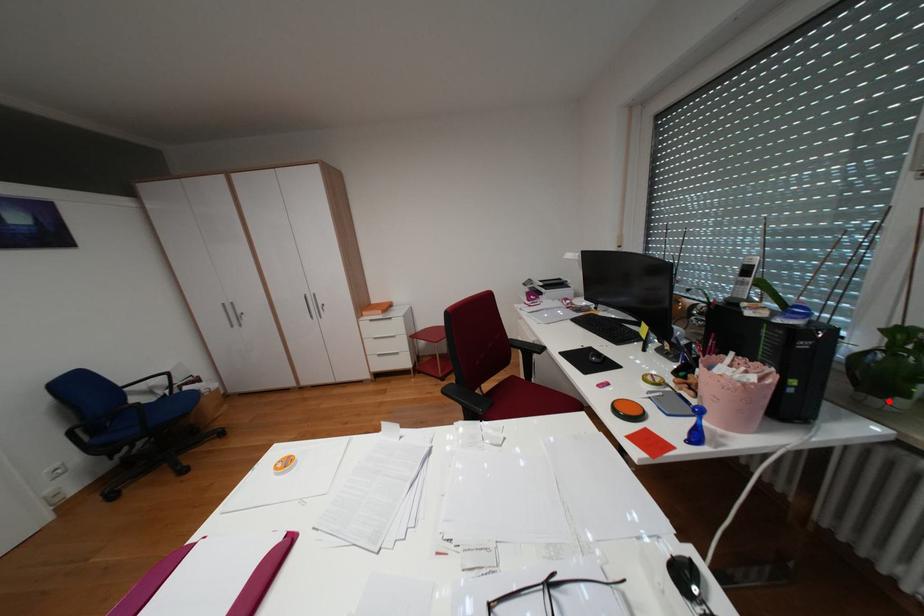
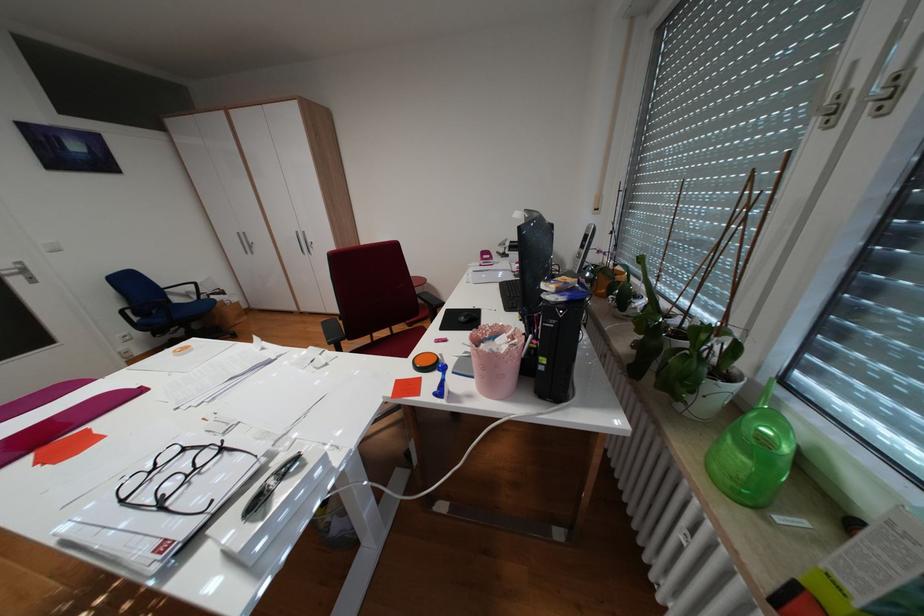
Question: I am providing you with two images of the same scene from different viewpoints. A red point is shown in image1. For the corresponding object point in image2, is it positioned nearer or farther from the camera?

Choices:
 (A) Nearer
 (B) Farther

Answer: (A)